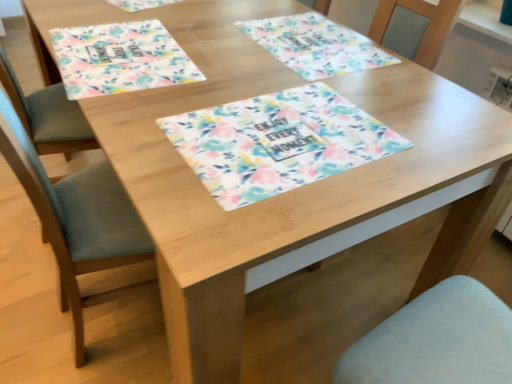
Question: Would you say floral fabric placemat at center, the first place mat when ordered from right to left, is inside or outside floral fabric placemat at upper left, the first place mat in the left-to-right sequence?

Choices:
 (A) inside
 (B) outside

Answer: (B)

Question: In the image, is floral fabric placemat at center, the first place mat when ordered from right to left, positioned in front of or behind floral fabric placemat at upper left, placed as the second place mat when sorted from right to left?

Choices:
 (A) behind
 (B) front

Answer: (A)

Question: Which object is the closest to the floral fabric placemat at center, positioned as the second place mat in left-to-right order?

Choices:
 (A) floral fabric placemat at center
 (B) floral fabric placemat at upper left, placed as the second place mat when sorted from right to left

Answer: (A)

Question: Which is farther from the floral fabric placemat at center, the first place mat when ordered from right to left?

Choices:
 (A) floral fabric placemat at center
 (B) floral fabric placemat at upper left, the first place mat in the left-to-right sequence

Answer: (B)